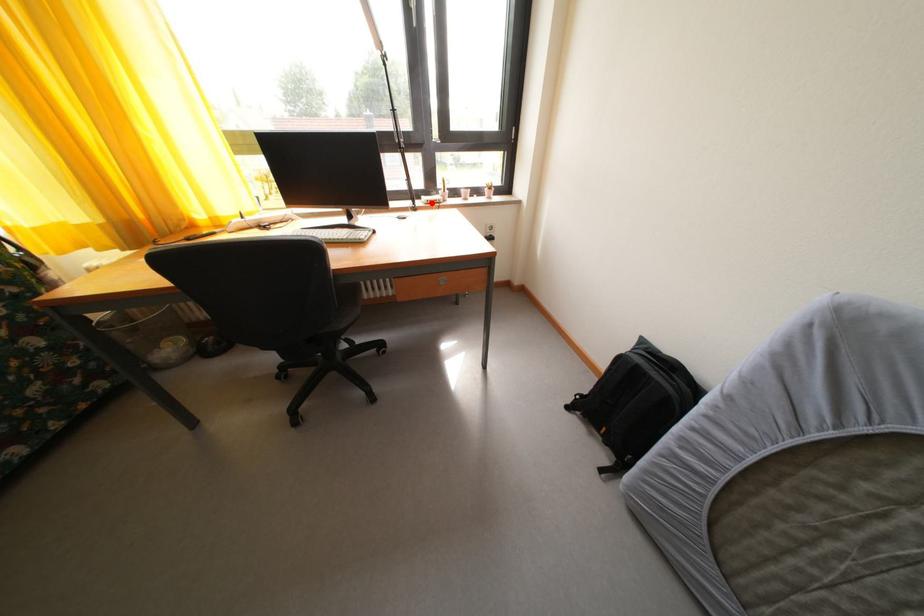
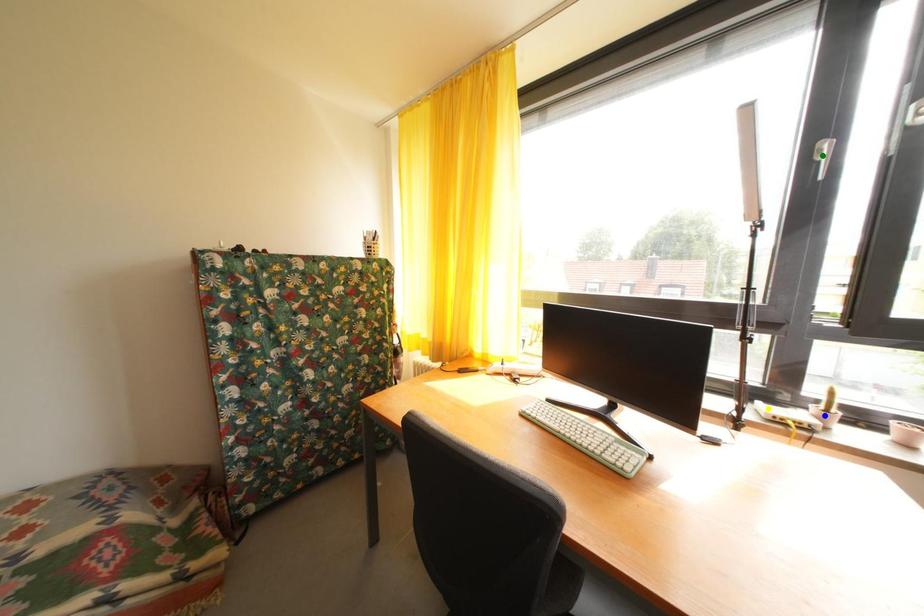
Question: I am providing you with two images of the same scene from different viewpoints. A red point is marked on the first image. You are given multiple points on the second image. Can you choose the point in image 2 that corresponds to the point in image 1?

Choices:
 (A) blue point
 (B) green point
 (C) yellow point

Answer: (C)